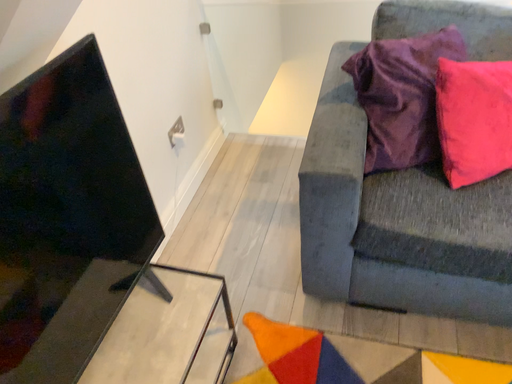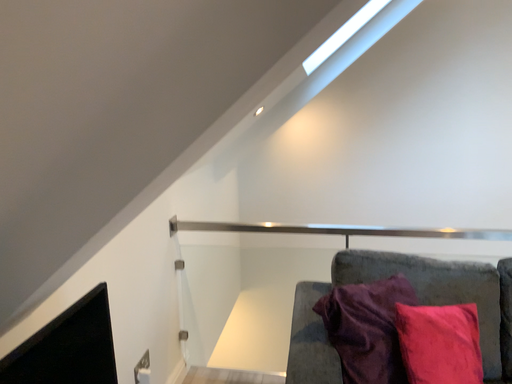
Question: How did the camera likely rotate when shooting the video?

Choices:
 (A) rotated right
 (B) rotated left

Answer: (A)